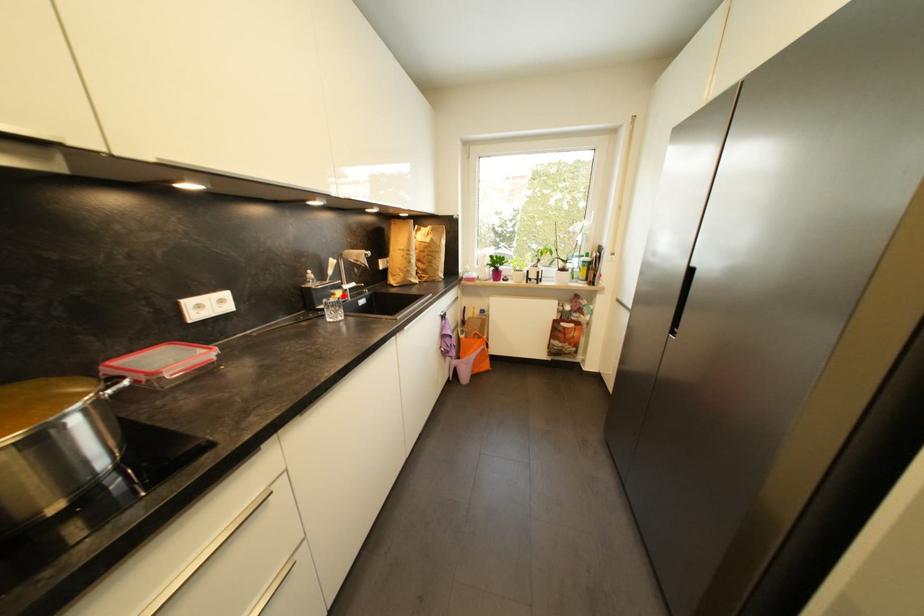
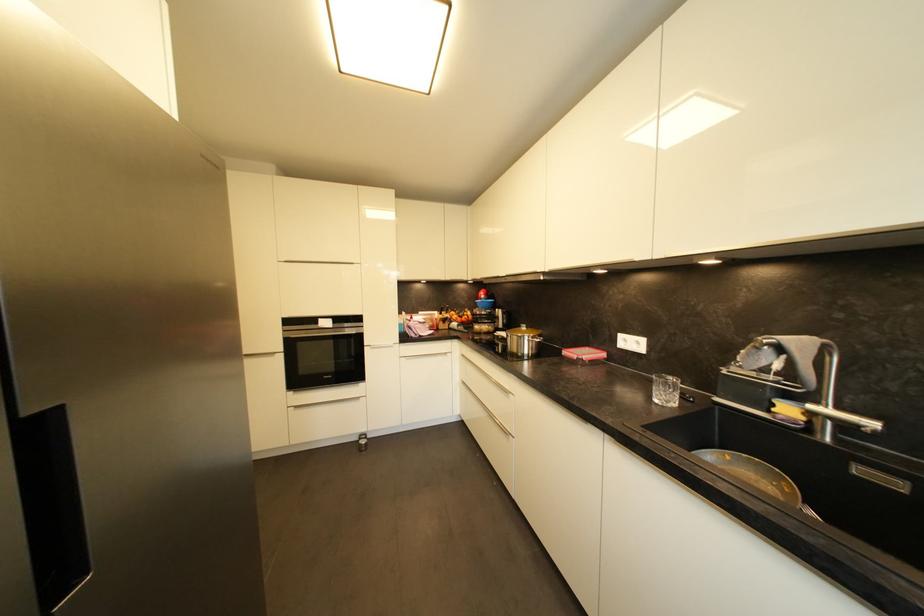
Where in the second image is the point corresponding to the highlighted location from the first image?

(793, 411)